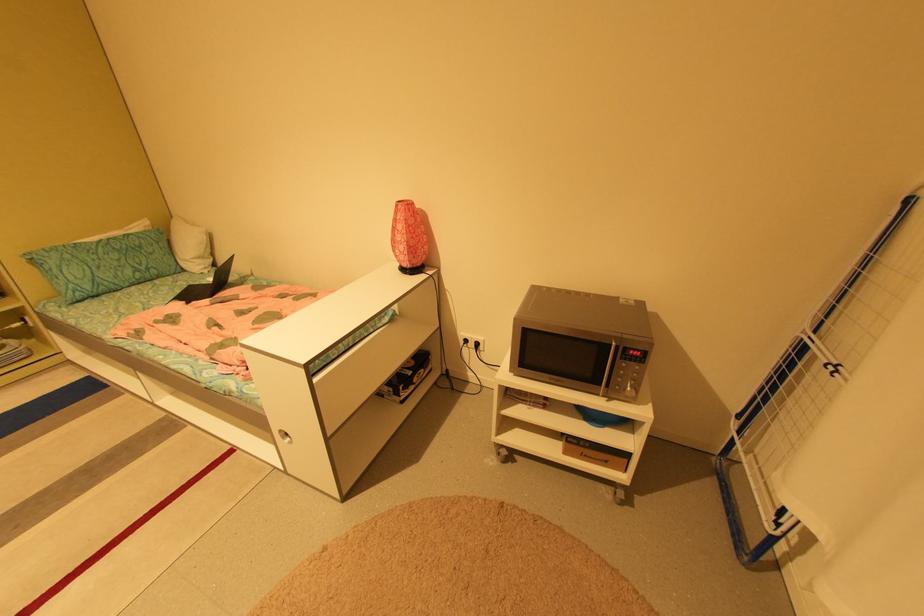
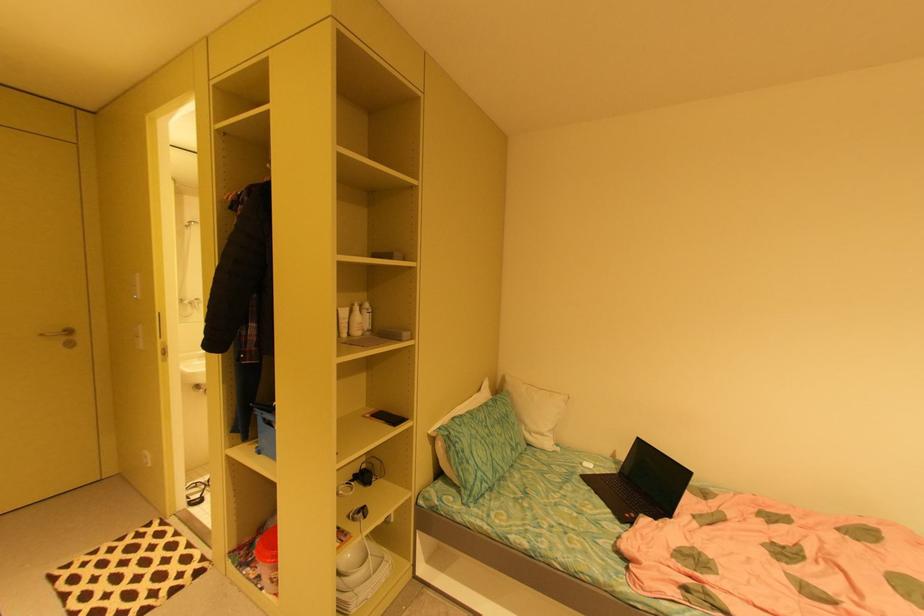
Question: The images are taken continuously from a first-person perspective. In which direction are you moving?

Choices:
 (A) Left
 (B) Right
 (C) Forward
 (D) Backward

Answer: (A)